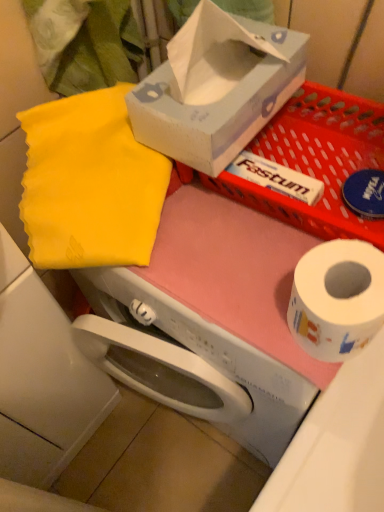
Locate an element on the screen. The image size is (384, 512). vacant position to the left of white paper at right is located at coordinates pos(219,298).